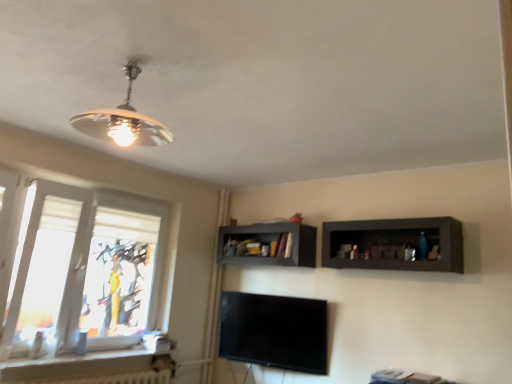
Question: Can you confirm if dark wood shelf at right, acting as the first shelf starting from the right, is wider than white glossy window sill at lower left?

Choices:
 (A) no
 (B) yes

Answer: (B)

Question: Is dark wood shelf at right, positioned as the 1th shelf in front-to-back order, outside of white glossy window sill at lower left?

Choices:
 (A) yes
 (B) no

Answer: (A)

Question: Is dark wood shelf at right, the 2th shelf viewed from the back, thinner than white glossy window sill at lower left?

Choices:
 (A) no
 (B) yes

Answer: (A)

Question: Is dark wood shelf at right, the 2th shelf viewed from the back, positioned behind white glossy window sill at lower left?

Choices:
 (A) no
 (B) yes

Answer: (B)

Question: Is dark wood shelf at right, the 2th shelf viewed from the back, closer to the viewer compared to white glossy window sill at lower left?

Choices:
 (A) yes
 (B) no

Answer: (B)

Question: Considering the relative sizes of dark wood shelf at right, positioned as the 1th shelf in front-to-back order, and white glossy window sill at lower left in the image provided, is dark wood shelf at right, positioned as the 1th shelf in front-to-back order, taller than white glossy window sill at lower left?

Choices:
 (A) yes
 (B) no

Answer: (A)

Question: Can you confirm if matte gray shelf at center, which is the first shelf from back to front, is wider than white textured radiator at lower left?

Choices:
 (A) no
 (B) yes

Answer: (B)

Question: Does matte gray shelf at center, the 2th shelf when ordered from right to left, lie behind white textured radiator at lower left?

Choices:
 (A) no
 (B) yes

Answer: (B)

Question: Is white textured radiator at lower left inside matte gray shelf at center, which is the first shelf from back to front?

Choices:
 (A) no
 (B) yes

Answer: (A)

Question: Can you confirm if matte gray shelf at center, which is the 2th shelf in front-to-back order, is positioned to the left of white textured radiator at lower left?

Choices:
 (A) no
 (B) yes

Answer: (A)

Question: Considering the relative sizes of matte gray shelf at center, which is the 2th shelf in front-to-back order, and white textured radiator at lower left in the image provided, is matte gray shelf at center, which is the 2th shelf in front-to-back order, taller than white textured radiator at lower left?

Choices:
 (A) yes
 (B) no

Answer: (A)

Question: Considering the relative sizes of matte gray shelf at center, the 2th shelf when ordered from right to left, and white textured radiator at lower left in the image provided, is matte gray shelf at center, the 2th shelf when ordered from right to left, smaller than white textured radiator at lower left?

Choices:
 (A) yes
 (B) no

Answer: (B)

Question: Are white glossy window sill at lower left and white textured window at left far apart?

Choices:
 (A) yes
 (B) no

Answer: (B)